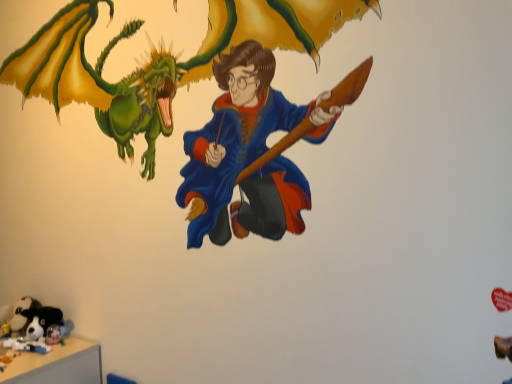
Question: Based on their positions, is soft plush toy at lower left located to the left or right of soft plush toy at bottom left?

Choices:
 (A) left
 (B) right

Answer: (A)

Question: From the image's perspective, is soft plush toy at lower left above or below soft plush toy at bottom left?

Choices:
 (A) above
 (B) below

Answer: (B)

Question: Is soft plush toy at lower left in front of or behind soft plush toy at bottom left in the image?

Choices:
 (A) front
 (B) behind

Answer: (B)

Question: Which is correct: soft plush toy at bottom left is inside soft plush toy at lower left, or outside of it?

Choices:
 (A) inside
 (B) outside

Answer: (B)

Question: Based on their positions, is soft plush toy at bottom left located to the left or right of soft plush toy at lower left?

Choices:
 (A) right
 (B) left

Answer: (A)

Question: Is soft plush toy at bottom left wider or thinner than soft plush toy at lower left?

Choices:
 (A) wide
 (B) thin

Answer: (A)

Question: From a real-world perspective, is soft plush toy at bottom left above or below soft plush toy at lower left?

Choices:
 (A) below
 (B) above

Answer: (B)